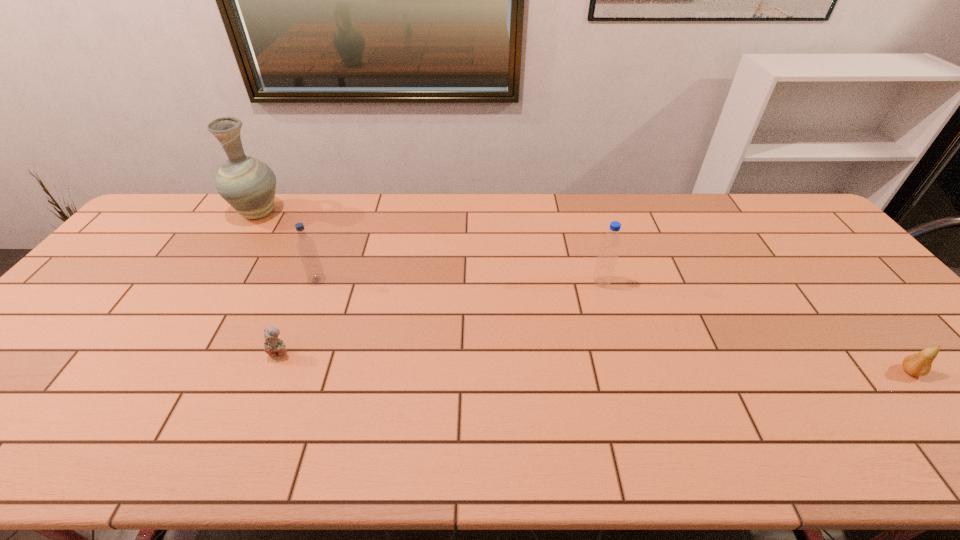
Locate an element on the screen. The width and height of the screenshot is (960, 540). empty space that is in between the right water bottle and the pear is located at coordinates (756, 327).

Identify the location of vacant area that lies between the tallest object and the right water bottle. The image size is (960, 540). (430, 248).

Where is `free space that is in between the fourth object from left to right and the teddy bear`? Image resolution: width=960 pixels, height=540 pixels. free space that is in between the fourth object from left to right and the teddy bear is located at coordinates (441, 318).

This screenshot has width=960, height=540. I want to click on free point between the teddy bear and the nearest object, so click(595, 363).

Locate an element on the screen. The image size is (960, 540). free spot between the rightmost object and the right water bottle is located at coordinates (756, 327).

Where is `empty space that is in between the tallest object and the left water bottle`? The image size is (960, 540). empty space that is in between the tallest object and the left water bottle is located at coordinates (288, 246).

Image resolution: width=960 pixels, height=540 pixels. I want to click on vacant point located between the nearest object and the tallest object, so click(x=585, y=292).

You are a GUI agent. You are given a task and a screenshot of the screen. Output one action in this format:
    pyautogui.click(x=<x>, y=<y>)
    Task: Click on the empty location between the left water bottle and the rightmost object
    The image size is (960, 540).
    Given the screenshot: What is the action you would take?
    pyautogui.click(x=613, y=326)

You are a GUI agent. You are given a task and a screenshot of the screen. Output one action in this format:
    pyautogui.click(x=<x>, y=<y>)
    Task: Click on the object identified as the closest to the second object from right to left
    
    Given the screenshot: What is the action you would take?
    pyautogui.click(x=919, y=364)

Image resolution: width=960 pixels, height=540 pixels. Find the location of `the fourth closest object to the left water bottle`. the fourth closest object to the left water bottle is located at coordinates (919, 364).